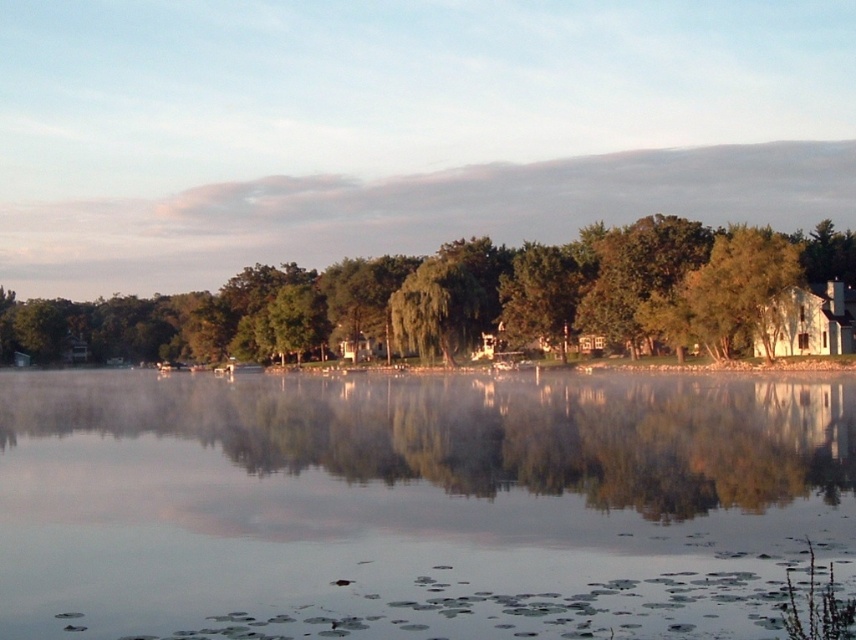
Question: In this image, where is white translucent fog at upper center located relative to green leafy tree at lower left?

Choices:
 (A) above
 (B) below

Answer: (A)

Question: Which of the following is the farthest from the observer?

Choices:
 (A) (108, 276)
 (B) (232, 316)

Answer: (A)

Question: Which point is closer to the camera taking this photo?

Choices:
 (A) (714, 268)
 (B) (520, 131)
 (C) (379, 444)

Answer: (C)

Question: Which point is farther to the camera?

Choices:
 (A) green leafy tree at lower left
 (B) transparent water at center
 (C) white translucent fog at upper center

Answer: (C)

Question: Considering the relative positions of transparent water at center and white translucent fog at upper center in the image provided, where is transparent water at center located with respect to white translucent fog at upper center?

Choices:
 (A) above
 (B) below

Answer: (B)

Question: From the image, what is the correct spatial relationship of transparent water at center in relation to green leafy tree at lower left?

Choices:
 (A) below
 (B) above

Answer: (A)